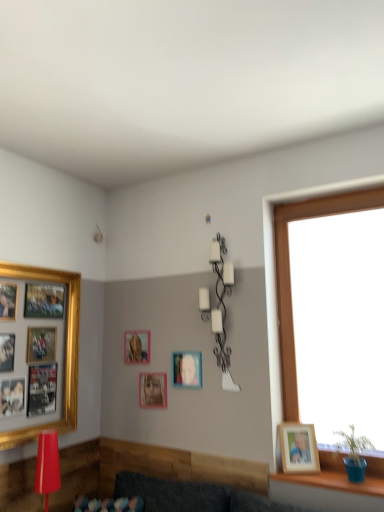
Question: Is wooden photo frame at right, which is the 1th picture frame from right to left, smaller than gold-framed collage at left, which ranks as the fifth picture frame in right-to-left order?

Choices:
 (A) yes
 (B) no

Answer: (A)

Question: Would you say gold-framed collage at left, which ranks as the fifth picture frame in right-to-left order, is part of wooden photo frame at right, the fifth picture frame positioned from the left,'s contents?

Choices:
 (A) yes
 (B) no

Answer: (B)

Question: From the image's perspective, is wooden photo frame at right, which is the 1th picture frame from right to left, on gold-framed collage at left, the first picture frame viewed from the left?

Choices:
 (A) no
 (B) yes

Answer: (A)

Question: Considering the relative positions of wooden photo frame at right, which is the 1th picture frame from right to left, and gold-framed collage at left, the first picture frame viewed from the left, in the image provided, is wooden photo frame at right, which is the 1th picture frame from right to left, to the right of gold-framed collage at left, the first picture frame viewed from the left, from the viewer's perspective?

Choices:
 (A) yes
 (B) no

Answer: (A)

Question: Could you tell me if wooden photo frame at right, the fifth picture frame positioned from the left, is facing gold-framed collage at left, which ranks as the fifth picture frame in right-to-left order?

Choices:
 (A) no
 (B) yes

Answer: (A)

Question: From the image's perspective, is gold-framed collage at left, which ranks as the fifth picture frame in right-to-left order, located above or below matte gold picture frame at center, which ranks as the 2th picture frame in left-to-right order?

Choices:
 (A) above
 (B) below

Answer: (A)

Question: Considering the positions of gold-framed collage at left, which ranks as the fifth picture frame in right-to-left order, and matte gold picture frame at center, arranged as the 4th picture frame when viewed from the right, in the image, is gold-framed collage at left, which ranks as the fifth picture frame in right-to-left order, wider or thinner than matte gold picture frame at center, arranged as the 4th picture frame when viewed from the right,?

Choices:
 (A) wide
 (B) thin

Answer: (A)

Question: Does point (4, 264) appear closer or farther from the camera than point (145, 348)?

Choices:
 (A) closer
 (B) farther

Answer: (A)

Question: Would you say gold-framed collage at left, which ranks as the fifth picture frame in right-to-left order, is to the left or to the right of matte gold picture frame at center, which ranks as the 2th picture frame in left-to-right order, in the picture?

Choices:
 (A) left
 (B) right

Answer: (A)

Question: Is wooden photo frame at right, the fifth picture frame positioned from the left, wider or thinner than pink matte picture frame at center, which appears as the 3th picture frame when viewed from the right?

Choices:
 (A) wide
 (B) thin

Answer: (A)

Question: From a real-world perspective, is wooden photo frame at right, the fifth picture frame positioned from the left, positioned above or below pink matte picture frame at center, the third picture frame from the left?

Choices:
 (A) above
 (B) below

Answer: (B)

Question: Looking at the image, does wooden photo frame at right, the fifth picture frame positioned from the left, seem bigger or smaller compared to pink matte picture frame at center, the third picture frame from the left?

Choices:
 (A) big
 (B) small

Answer: (A)

Question: Is wooden photo frame at right, which is the 1th picture frame from right to left, to the left or to the right of pink matte picture frame at center, which appears as the 3th picture frame when viewed from the right, in the image?

Choices:
 (A) left
 (B) right

Answer: (B)

Question: In terms of height, does blue plastic pot at lower right look taller or shorter compared to wooden photo frame at right, which is the 1th picture frame from right to left?

Choices:
 (A) short
 (B) tall

Answer: (A)

Question: Choose the correct answer: Is blue plastic pot at lower right inside wooden photo frame at right, the fifth picture frame positioned from the left, or outside it?

Choices:
 (A) outside
 (B) inside

Answer: (A)